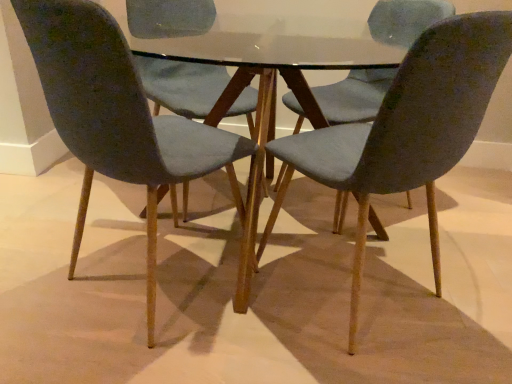
The image size is (512, 384). In order to click on vacant area that lies between glass table at center and matte blue chair at center, placed as the third chair when sorted from left to right in this screenshot , I will do `click(345, 291)`.